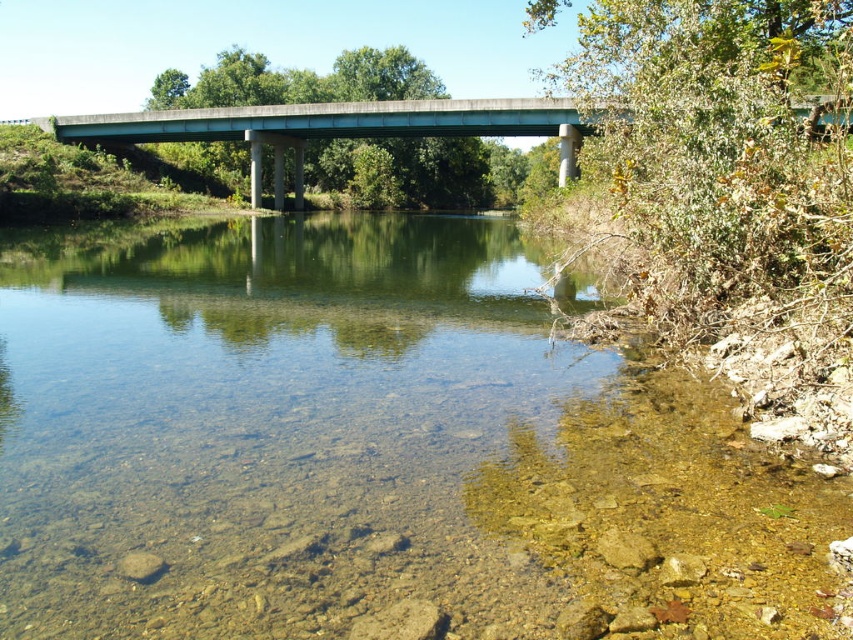
You are a pedestrian standing on the concrete bridge at center. You want to cross to the other side. Can you see the clear gravel river at center from where you are standing?

The clear gravel river at center is smaller than the concrete bridge at center, so yes, you can see the clear gravel river at center from where you are standing because the bridge is larger and spans over it, allowing visibility.

You are standing at the bridge and looking down at the river. There are two points marked on the water surface. The first point is at coordinates point (773, 586) and the second point is at point (436, 122). Which of these two points appears closer to you?

Point (773, 586) is closer to the camera than point (436, 122), so the first point appears closer to you.

You are a construction worker assessing the bridge and river. Which structure has a longer length? Please refer to the clear gravel river at center and the concrete bridge at center in your answer.

The concrete bridge at center is longer than the clear gravel river at center.